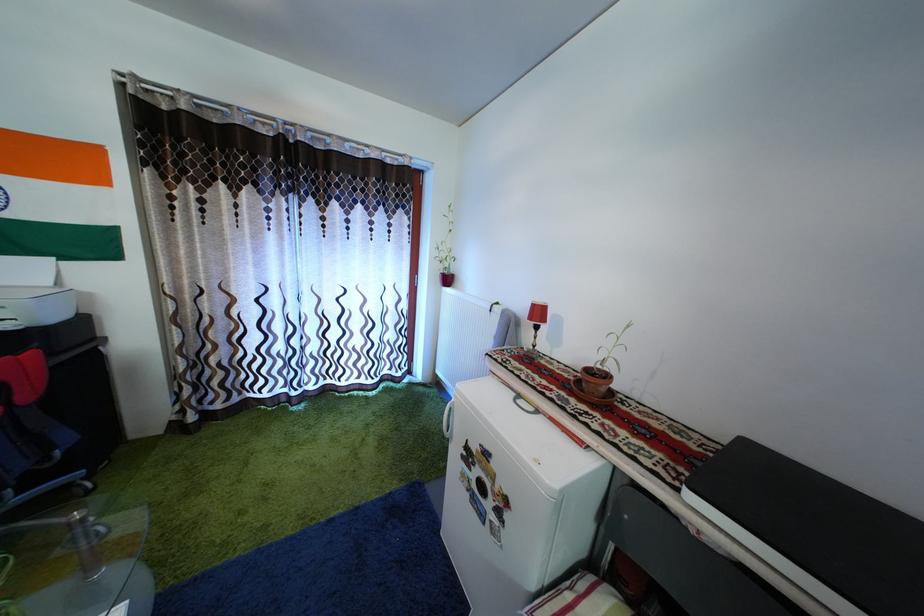
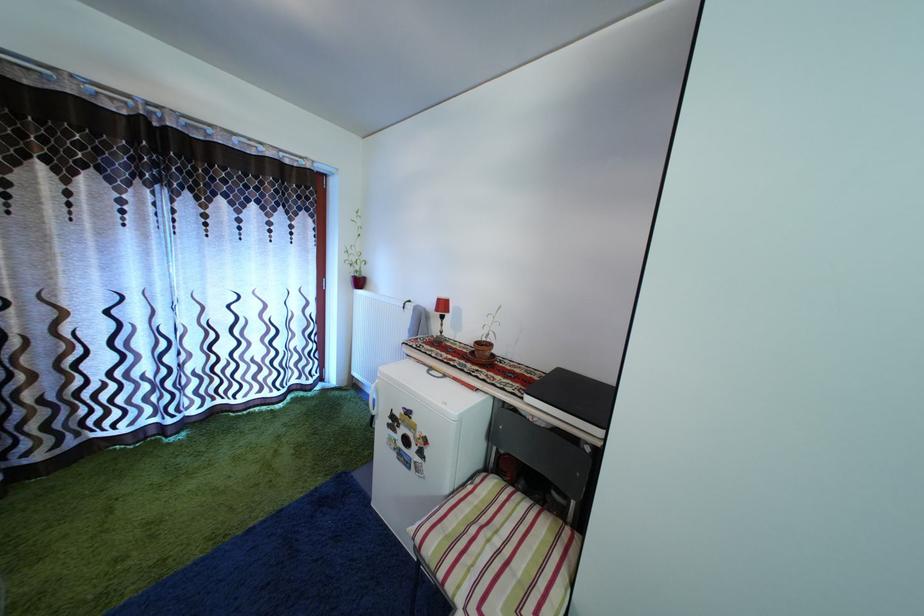
The point at (541, 313) is marked in the first image. Where is the corresponding point in the second image?

(446, 308)